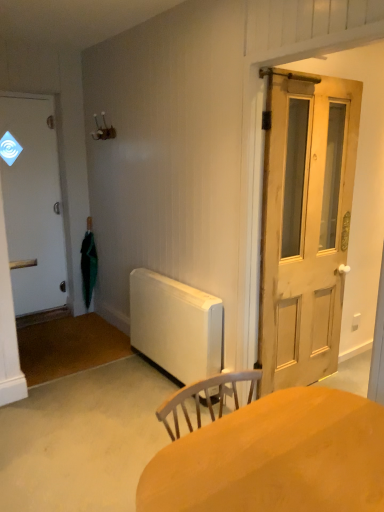
Question: Are white matte door at left, the 2th door positioned from the front, and natural wood door at right, which is the 1th door in right-to-left order, making contact?

Choices:
 (A) no
 (B) yes

Answer: (A)

Question: Considering the relative sizes of white matte door at left, the second door in the right-to-left sequence, and natural wood door at right, which is the 1th door in right-to-left order, in the image provided, is white matte door at left, the second door in the right-to-left sequence, wider than natural wood door at right, which is the 1th door in right-to-left order,?

Choices:
 (A) no
 (B) yes

Answer: (B)

Question: Is white matte door at left, the first door positioned from the left, shorter than natural wood door at right, which is the 1th door in right-to-left order?

Choices:
 (A) yes
 (B) no

Answer: (B)

Question: Is white matte door at left, the first door positioned from the left, closer to the viewer compared to natural wood door at right, which is the 1th door in right-to-left order?

Choices:
 (A) no
 (B) yes

Answer: (A)

Question: Is white matte door at left, the first door positioned from the left, further to the viewer compared to natural wood door at right, which is counted as the 2th door, starting from the left?

Choices:
 (A) no
 (B) yes

Answer: (B)

Question: In the image, is natural wood door at right, which is the 1th door in right-to-left order, positioned in front of or behind green matte umbrella at left?

Choices:
 (A) front
 (B) behind

Answer: (A)

Question: In the image, is natural wood door at right, placed as the first door when sorted from front to back, on the left side or the right side of green matte umbrella at left?

Choices:
 (A) right
 (B) left

Answer: (A)

Question: Looking at the image, does natural wood door at right, which is the 1th door in right-to-left order, seem bigger or smaller compared to green matte umbrella at left?

Choices:
 (A) small
 (B) big

Answer: (B)

Question: Is point (271, 388) closer or farther from the camera than point (94, 245)?

Choices:
 (A) farther
 (B) closer

Answer: (B)

Question: Is smooth wooden desk at center taller or shorter than green matte umbrella at left?

Choices:
 (A) short
 (B) tall

Answer: (A)

Question: Is point (336, 419) positioned closer to the camera than point (87, 293)?

Choices:
 (A) closer
 (B) farther

Answer: (A)

Question: From a real-world perspective, is smooth wooden desk at center physically located above or below green matte umbrella at left?

Choices:
 (A) above
 (B) below

Answer: (B)

Question: In terms of size, does smooth wooden desk at center appear bigger or smaller than green matte umbrella at left?

Choices:
 (A) big
 (B) small

Answer: (A)

Question: Do you think natural wood door at right, which is the 1th door in right-to-left order, is within white matte door at left, the 1th door when ordered from back to front, or outside of it?

Choices:
 (A) inside
 (B) outside

Answer: (B)

Question: Based on their positions, is natural wood door at right, which is counted as the 2th door, starting from the left, located to the left or right of white matte door at left, the 2th door positioned from the front?

Choices:
 (A) right
 (B) left

Answer: (A)